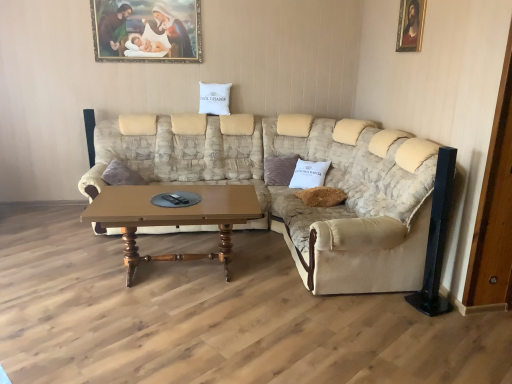
Locate an element on the screen. This screenshot has height=384, width=512. vacant area that lies in front of wooden polished coffee table at center is located at coordinates (179, 333).